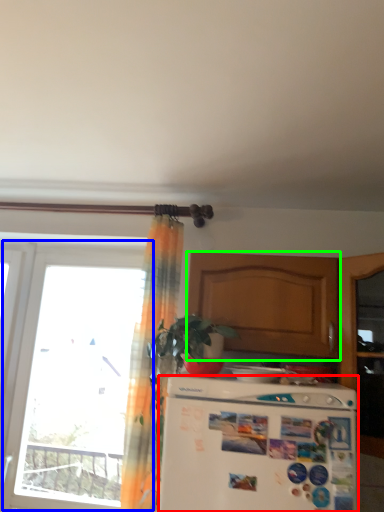
Question: Which is nearer to the refrigerator (highlighted by a red box)? window (highlighted by a blue box) or cabinetry (highlighted by a green box).

Choices:
 (A) window
 (B) cabinetry

Answer: (B)